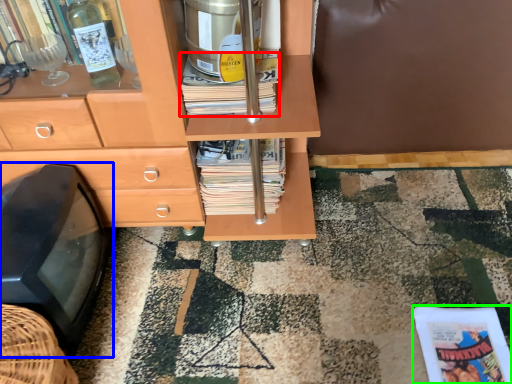
Question: Considering the real-world distances, which object is farthest from book (highlighted by a red box)? flat (highlighted by a blue box) or paperback book (highlighted by a green box)?

Choices:
 (A) flat
 (B) paperback book

Answer: (B)